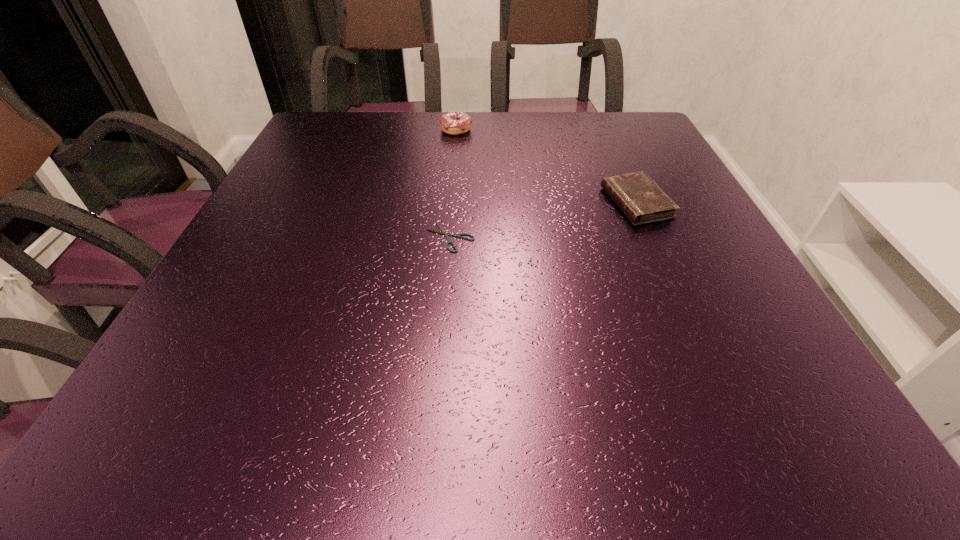
At what (x,y) coordinates should I click in order to perform the action: click on vacant space that satisfies the following two spatial constraints: 1. on the front side of the doughnut; 2. on the right side of the second shortest object. Please return your answer as a coordinate pair (x, y). The height and width of the screenshot is (540, 960). Looking at the image, I should click on (449, 203).